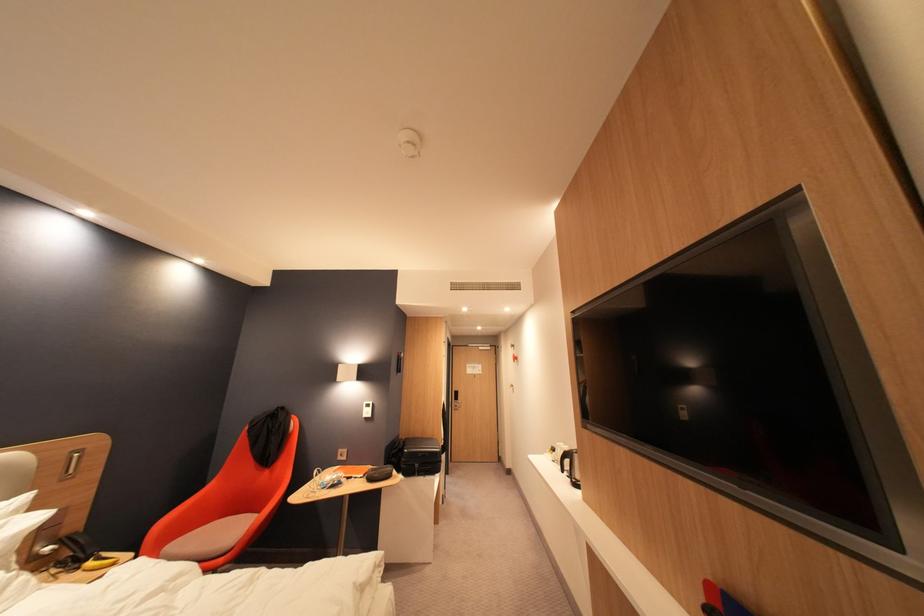
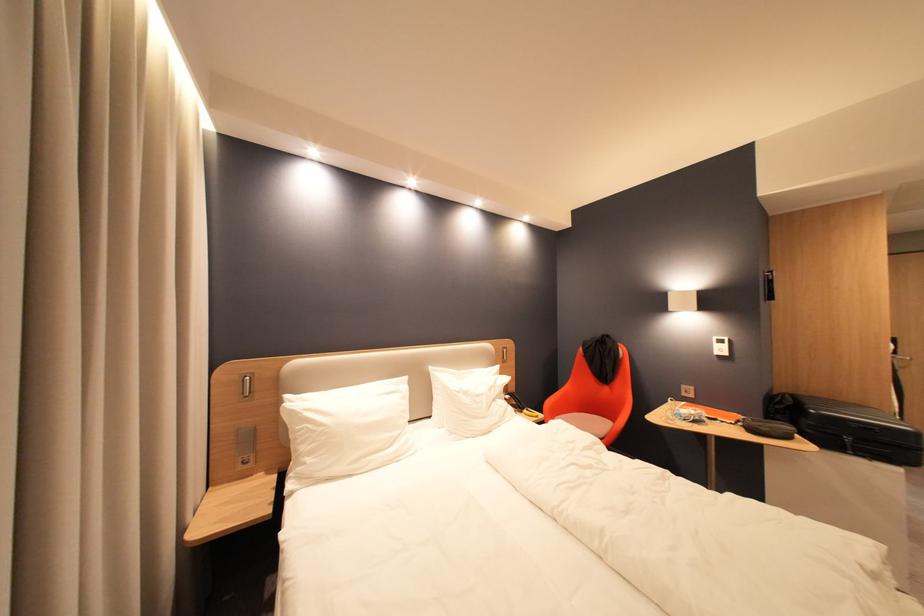
Question: How did the camera likely rotate?

Choices:
 (A) Left
 (B) Right
 (C) Up
 (D) Down

Answer: (A)